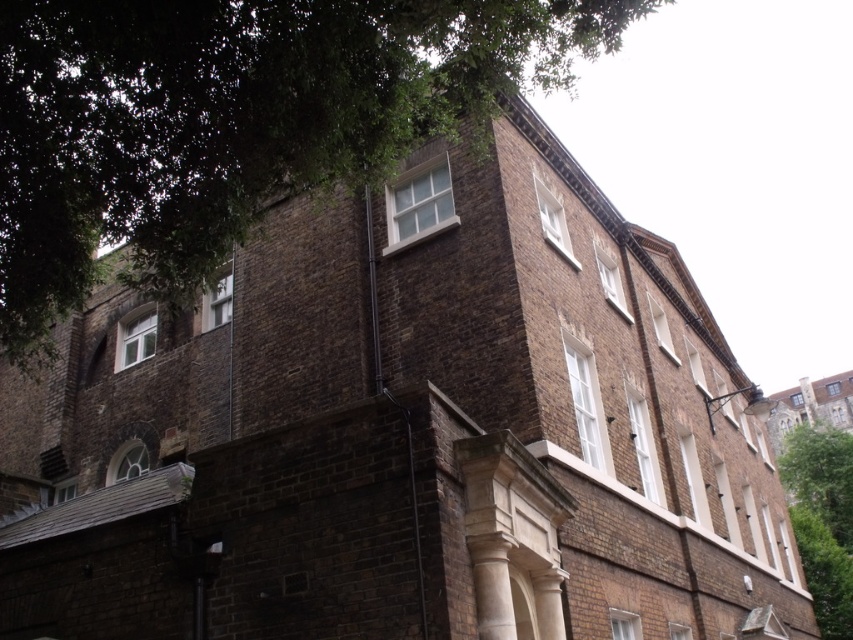
You are standing in front of the multi story brick building. You see a point marked at coordinate (233,122). What object is located at that point?

The point at coordinate (233,122) corresponds to a green leafy tree at upper left.

You are standing in front of the multi story brick building and want to plant a new tree between the green leafy tree at right and the green leafy tree at lower right. The new tree requires a minimum of 30 feet of space between it and the nearest existing tree. Based on the current spacing between the existing trees, is this possible?

The green leafy tree at right is 44.23 feet away from the green leafy tree at lower right. Since the required minimum space is 30 feet, planting a new tree between them would be possible as the existing spacing exceeds the required distance.

You are a window washer standing on a platform that can only move vertically. You need to clean the windows between the green leafy tree at upper left and the green leafy tree at lower right. Which tree will block your view of the lower windows first as you descend?

The green leafy tree at upper left will block your view of the lower windows first as you descend because it is positioned over the green leafy tree at lower right, meaning it is closer to the platform when you start at the top.